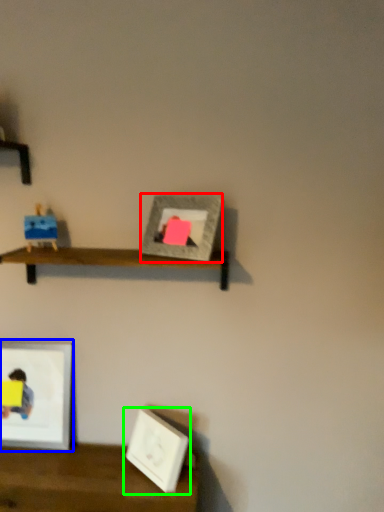
Question: Considering the real-world distances, which object is closest to picture frame (highlighted by a red box)? picture frame (highlighted by a blue box) or picture frame (highlighted by a green box).

Choices:
 (A) picture frame
 (B) picture frame

Answer: (B)